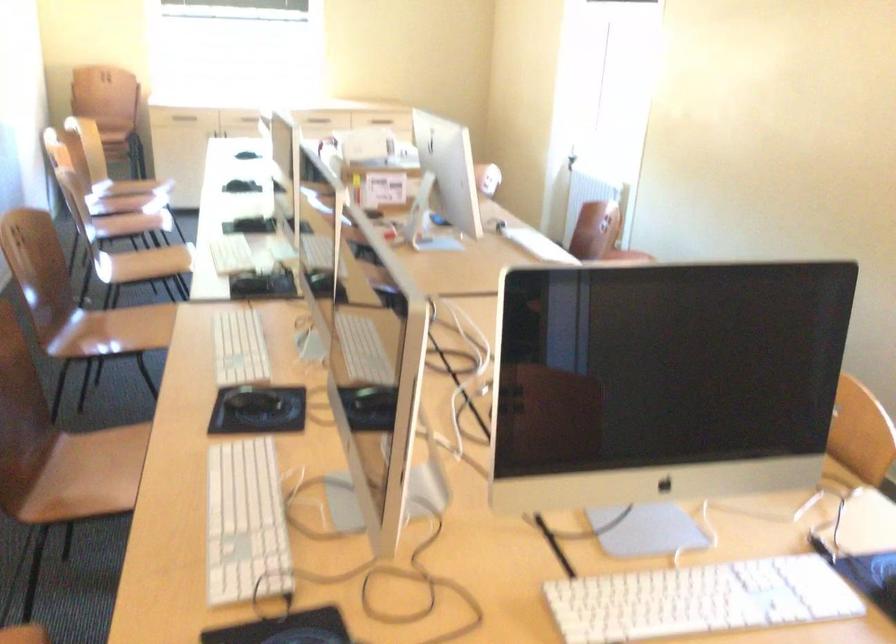
Question: The camera is either moving clockwise (left) or counter-clockwise (right) around the object. The first image is from the beginning of the video and the second image is from the end. Is the camera moving left or right when shooting the video?

Choices:
 (A) Left
 (B) Right

Answer: (A)